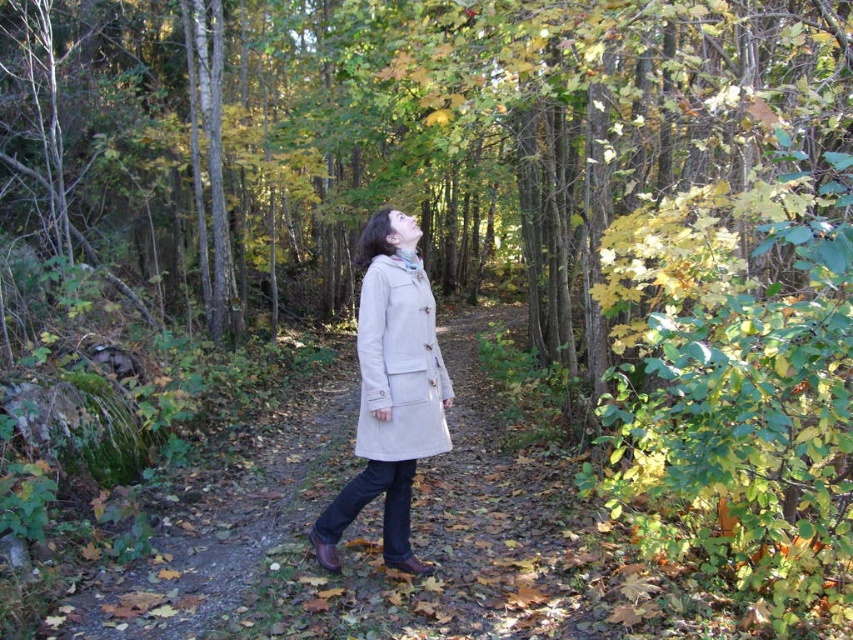
Question: Does beige wool coat at center have a lesser width compared to beige cotton trench coat at center?

Choices:
 (A) yes
 (B) no

Answer: (B)

Question: Which of these objects is positioned closest to the beige cotton trench coat at center?

Choices:
 (A) beige wool coat at center
 (B) light beige fabric path at center

Answer: (A)

Question: Is beige wool coat at center to the right of beige cotton trench coat at center from the viewer's perspective?

Choices:
 (A) yes
 (B) no

Answer: (B)

Question: Can you confirm if light beige fabric path at center is bigger than beige wool coat at center?

Choices:
 (A) no
 (B) yes

Answer: (B)

Question: Which is farther from the beige wool coat at center?

Choices:
 (A) beige cotton trench coat at center
 (B) light beige fabric path at center

Answer: (B)

Question: Which object appears farthest from the camera in this image?

Choices:
 (A) light beige fabric path at center
 (B) beige cotton trench coat at center
 (C) beige wool coat at center

Answer: (C)